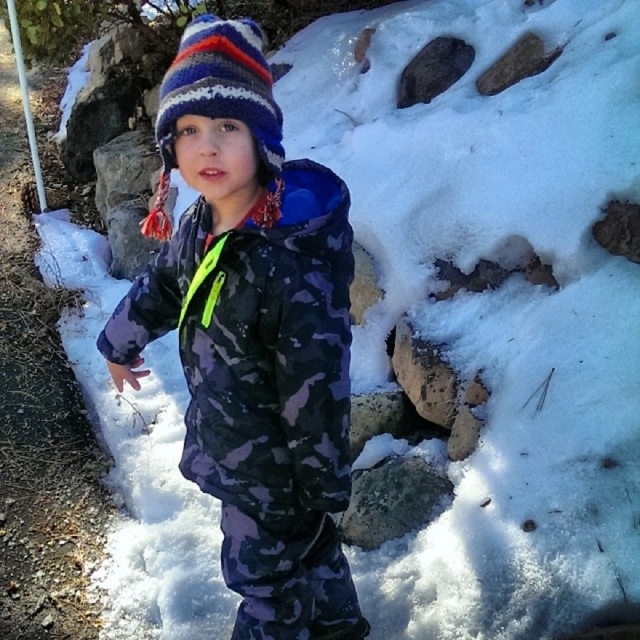
Is striped knit hat at center bigger than metallic pole at upper left?

No.

Where is `striped knit hat at center`? This screenshot has height=640, width=640. striped knit hat at center is located at coordinates (220, 106).

Locate an element on the screen. The height and width of the screenshot is (640, 640). striped knit hat at center is located at coordinates 220,106.

Between point (237, 275) and point (211, 36), which one is positioned in front?

Positioned in front is point (211, 36).

Does camo fabric snowsuit at center have a lesser height compared to striped knit hat at center?

No, camo fabric snowsuit at center is not shorter than striped knit hat at center.

The width and height of the screenshot is (640, 640). I want to click on camo fabric snowsuit at center, so click(x=252, y=333).

Is camo fabric snowsuit at center above metallic pole at upper left?

Incorrect, camo fabric snowsuit at center is not positioned above metallic pole at upper left.

Is camo fabric snowsuit at center wider than metallic pole at upper left?

No.

What do you see at coordinates (252, 333) in the screenshot? The width and height of the screenshot is (640, 640). I see `camo fabric snowsuit at center` at bounding box center [252, 333].

The image size is (640, 640). What are the coordinates of `camo fabric snowsuit at center` in the screenshot? It's located at (252, 333).